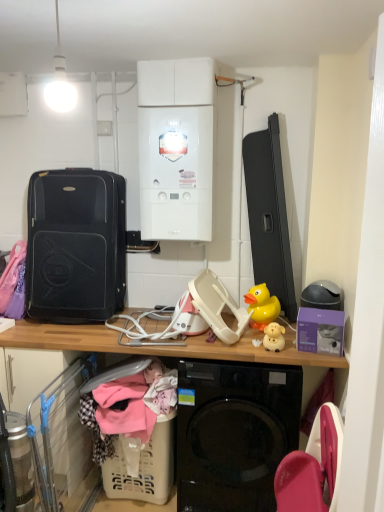
Where is `unoccupied space behind matte yellow plastic toy at center, which is counted as the 1th toy, starting from the front`? unoccupied space behind matte yellow plastic toy at center, which is counted as the 1th toy, starting from the front is located at coordinates pos(273,338).